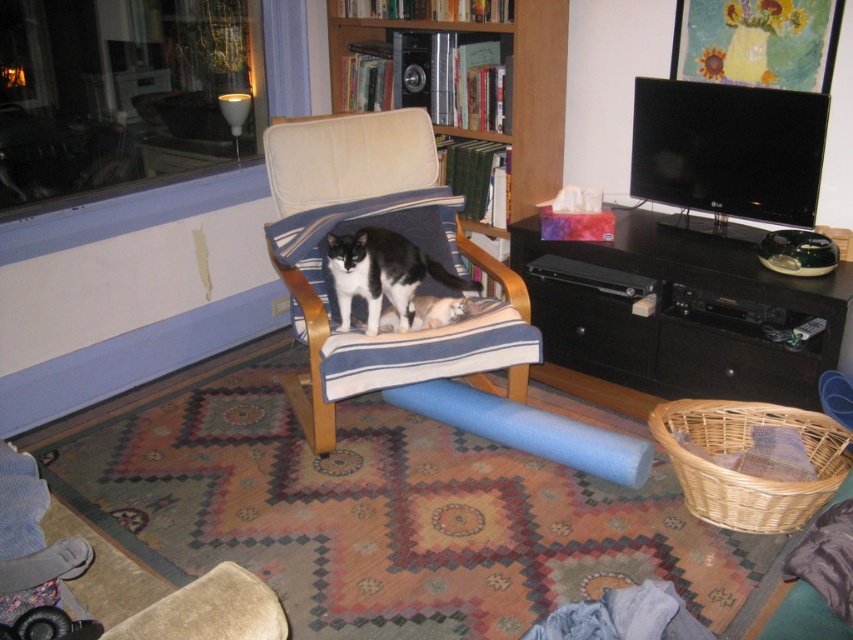
Question: Which point appears farthest from the camera in this image?

Choices:
 (A) (310, 310)
 (B) (390, 305)
 (C) (509, 74)
 (D) (604, 358)

Answer: (C)

Question: Does soft beige fabric rocking chair at center have a lesser width compared to wooden bookshelf at upper center?

Choices:
 (A) no
 (B) yes

Answer: (B)

Question: Which of the following is the closest to the observer?

Choices:
 (A) (338, 184)
 (B) (793, 282)

Answer: (B)

Question: Which is farther from the wooden bookshelf at upper center?

Choices:
 (A) black wood entertainment center at right
 (B) soft beige fabric rocking chair at center

Answer: (A)

Question: Is black wood entertainment center at right above wooden bookshelf at upper center?

Choices:
 (A) no
 (B) yes

Answer: (A)

Question: Is black wood entertainment center at right wider than soft beige fabric rocking chair at center?

Choices:
 (A) yes
 (B) no

Answer: (A)